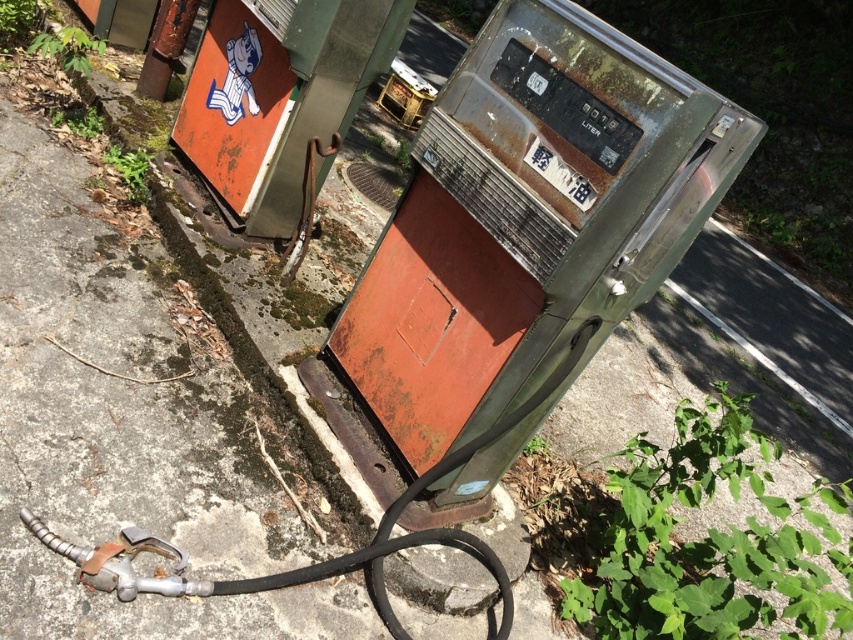
Question: Which point appears closest to the camera in this image?

Choices:
 (A) (683, 504)
 (B) (138, 160)

Answer: (A)

Question: Which is farther from the green leafy weed at upper left?

Choices:
 (A) green leafy plant at lower right
 (B) rusty metal gas pump at center
 (C) green leafy plant at upper left

Answer: (A)

Question: Is rusty metal gas pump at center above green leafy weed at upper left?

Choices:
 (A) yes
 (B) no

Answer: (B)

Question: In this image, where is green leafy plant at lower right located relative to green leafy plant at upper left?

Choices:
 (A) left
 (B) right

Answer: (B)

Question: Can you confirm if rusty metal gas pump at center is positioned to the left of green leafy weed at upper left?

Choices:
 (A) no
 (B) yes

Answer: (A)

Question: Among these objects, which one is farthest from the camera?

Choices:
 (A) rusty metal gas pump at center
 (B) green leafy plant at lower right

Answer: (B)